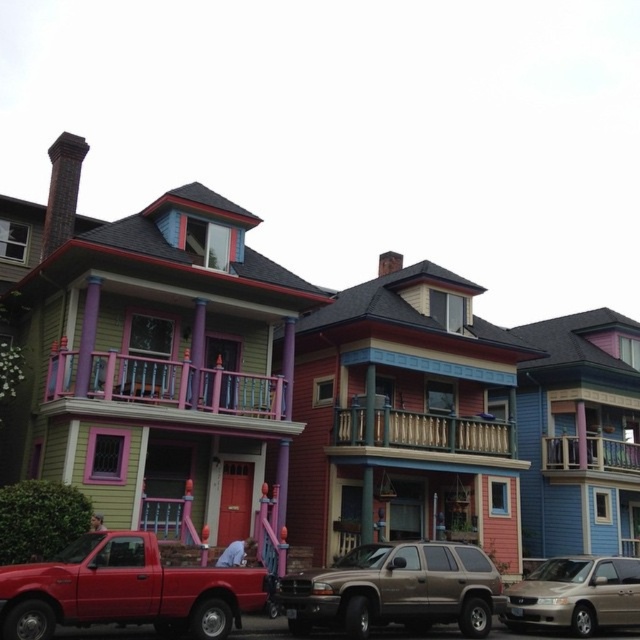
Describe the element at coordinates (124, 589) in the screenshot. I see `metallic red pickup truck at lower left` at that location.

Locate an element on the screen. This screenshot has width=640, height=640. metallic red pickup truck at lower left is located at coordinates (124, 589).

At what (x,y) coordinates should I click in order to perform the action: click on matte gold suv at center. Please return your answer as a coordinate pair (x, y). The width and height of the screenshot is (640, 640). Looking at the image, I should click on (396, 589).

Does point (371, 582) lie behind point (572, 596)?

No.

You are a GUI agent. You are given a task and a screenshot of the screen. Output one action in this format:
    pyautogui.click(x=<x>, y=<y>)
    Task: Click on the matte gold suv at center
    The image size is (640, 640).
    Given the screenshot: What is the action you would take?
    pyautogui.click(x=396, y=589)

At what (x,y) coordinates should I click in order to perform the action: click on matte gold suv at center. Please return your answer as a coordinate pair (x, y). This screenshot has height=640, width=640. Looking at the image, I should click on (396, 589).

The height and width of the screenshot is (640, 640). Describe the element at coordinates (164, 392) in the screenshot. I see `pink painted wood at center` at that location.

Which is more to the right, pink painted wood at center or wooden railing at upper center?

wooden railing at upper center is more to the right.

Is point (112, 365) less distant than point (541, 452)?

Yes, point (112, 365) is in front of point (541, 452).

Image resolution: width=640 pixels, height=640 pixels. I want to click on pink painted wood at center, so click(x=164, y=392).